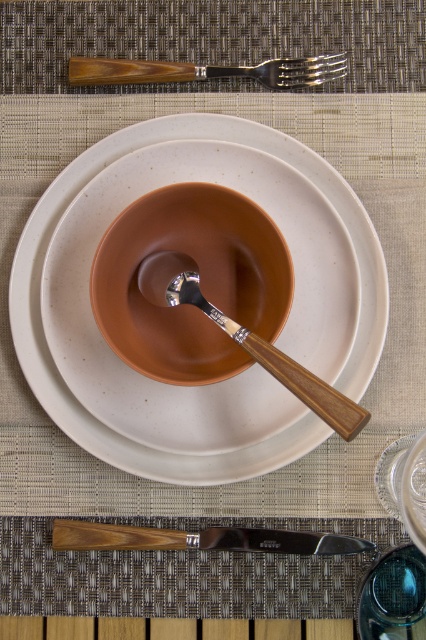
Question: Among these objects, which one is farthest from the camera?

Choices:
 (A) wooden spoon at center
 (B) wooden handle fork at top

Answer: (B)

Question: Among these points, which one is farthest from the camera?

Choices:
 (A) (178, 301)
 (B) (34, 339)

Answer: (B)

Question: Is matte ceramic platter at center to the left of polished silver knife at lower center from the viewer's perspective?

Choices:
 (A) yes
 (B) no

Answer: (A)

Question: Can you confirm if polished silver knife at lower center is smaller than wooden spoon at center?

Choices:
 (A) no
 (B) yes

Answer: (B)

Question: Estimate the real-world distances between objects in this image. Which object is farther from the polished silver knife at lower center?

Choices:
 (A) wooden handle fork at top
 (B) wooden spoon at center

Answer: (A)

Question: Is polished silver knife at lower center bigger than wooden handle fork at top?

Choices:
 (A) yes
 (B) no

Answer: (A)